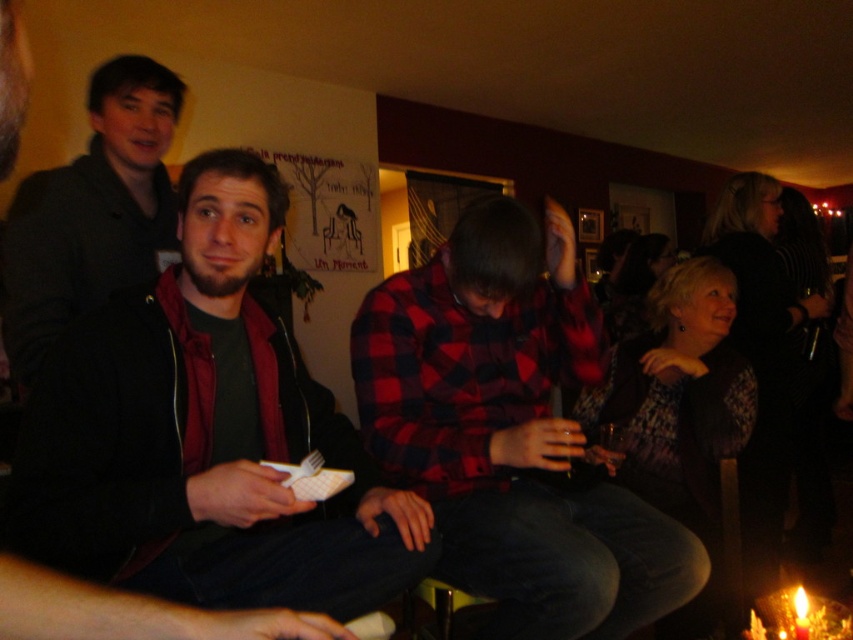
What do you see at coordinates (206, 435) in the screenshot? I see `matte black jacket at center` at bounding box center [206, 435].

Where is `matte black jacket at center`? This screenshot has width=853, height=640. matte black jacket at center is located at coordinates (206, 435).

Locate an element on the screen. The width and height of the screenshot is (853, 640). matte black jacket at center is located at coordinates click(x=206, y=435).

Which is in front, point (556, 280) or point (167, 104)?

Point (556, 280) is in front.

Can you confirm if red plaid shirt at center is positioned to the left of matte black jacket at upper left?

Incorrect, red plaid shirt at center is not on the left side of matte black jacket at upper left.

Which is behind, point (392, 304) or point (117, 268)?

Positioned behind is point (117, 268).

I want to click on red plaid shirt at center, so click(x=511, y=432).

In the scene shown: Can you confirm if matte black jacket at center is positioned above red plaid shirt at center?

Correct, matte black jacket at center is located above red plaid shirt at center.

Can you confirm if matte black jacket at center is positioned below red plaid shirt at center?

No, matte black jacket at center is not below red plaid shirt at center.

Between point (59, 413) and point (492, 378), which one is positioned in front?

Positioned in front is point (59, 413).

At what (x,y) coordinates should I click in order to perform the action: click on matte black jacket at center. Please return your answer as a coordinate pair (x, y). Looking at the image, I should click on (206, 435).